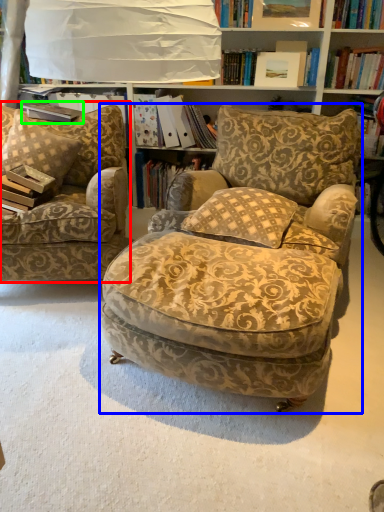
Question: Estimate the real-world distances between objects in this image. Which object is farther from chair (highlighted by a red box), chair (highlighted by a blue box) or paperback book (highlighted by a green box)?

Choices:
 (A) chair
 (B) paperback book

Answer: (A)